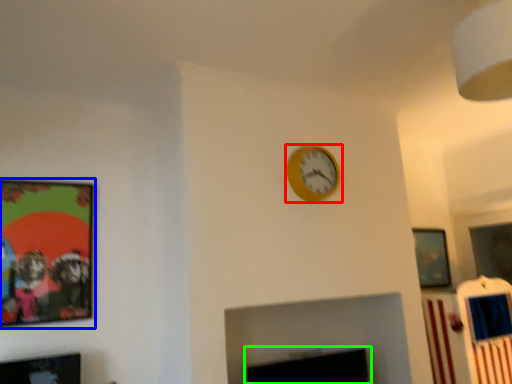
Question: Estimate the real-world distances between objects in this image. Which object is closer to wall clock (highlighted by a red box), picture frame (highlighted by a blue box) or fireplace (highlighted by a green box)?

Choices:
 (A) picture frame
 (B) fireplace

Answer: (B)